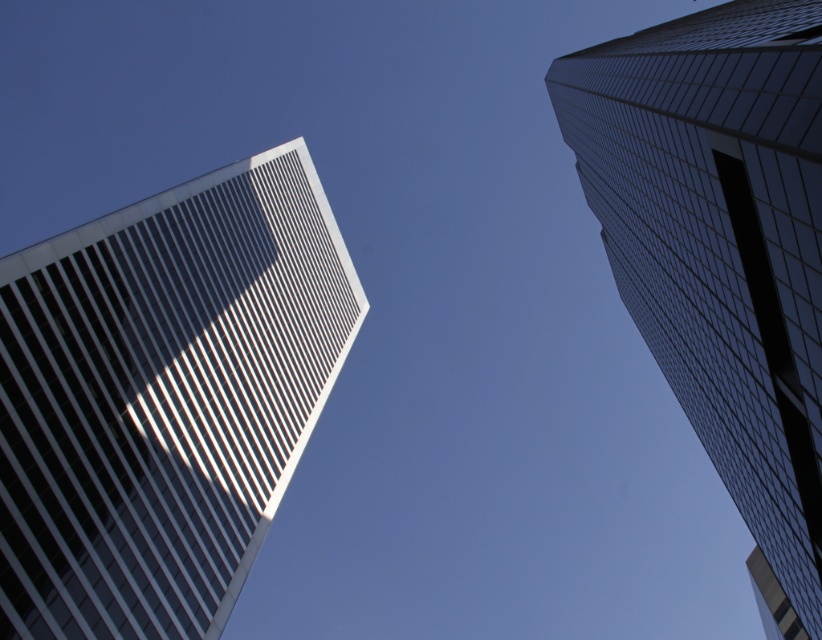
Locate an element on the screen. The height and width of the screenshot is (640, 822). white glass building at upper left is located at coordinates (164, 397).

Describe the element at coordinates (164, 397) in the screenshot. The width and height of the screenshot is (822, 640). I see `white glass building at upper left` at that location.

Does point (12, 436) lie behind point (709, 186)?

Yes, it is.

Where is `white glass building at upper left`? The image size is (822, 640). white glass building at upper left is located at coordinates (164, 397).